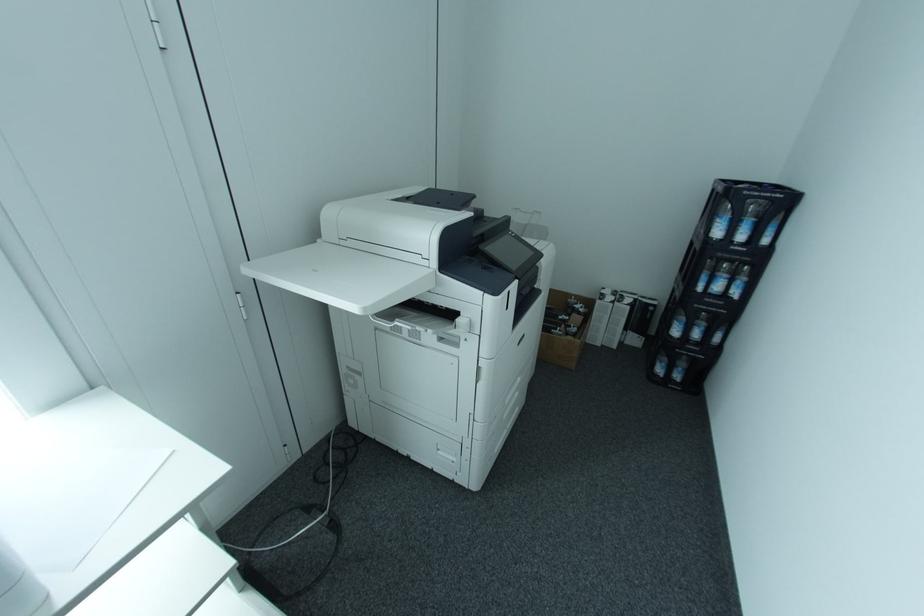
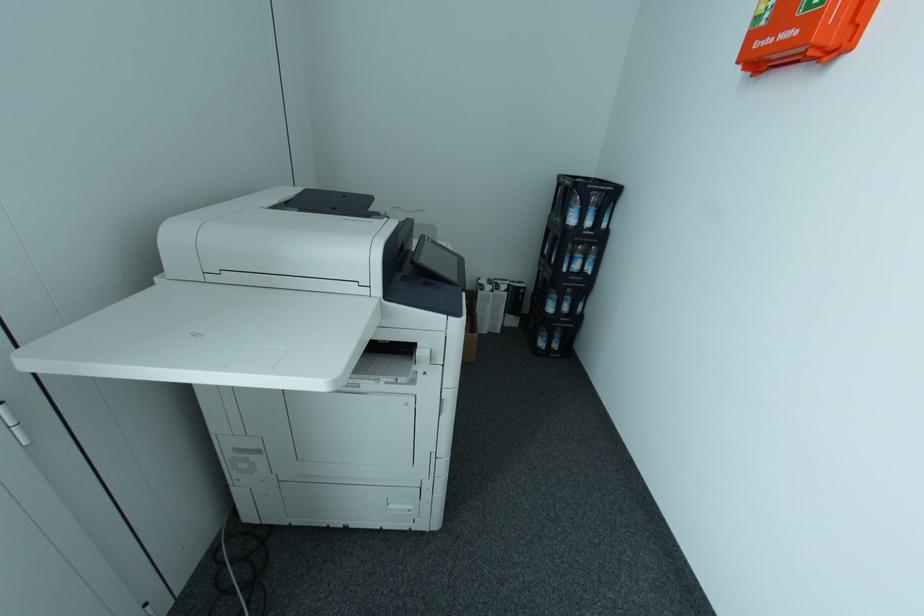
The images are taken continuously from a first-person perspective. In which direction are you moving?

The cameraman moved toward left, forward.